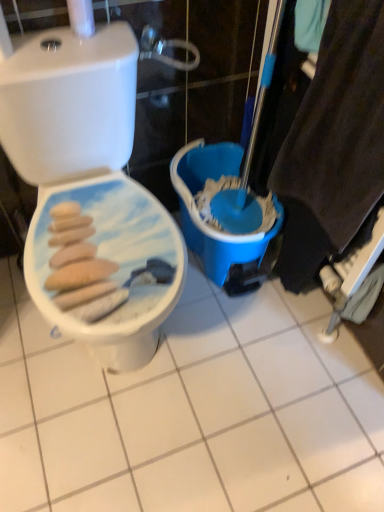
Question: Is blue plastic bucket at center to the right of white glossy ceramic tile at center from the viewer's perspective?

Choices:
 (A) yes
 (B) no

Answer: (A)

Question: From the image's perspective, is blue plastic bucket at center located beneath white glossy ceramic tile at center?

Choices:
 (A) no
 (B) yes

Answer: (A)

Question: Considering the relative sizes of blue plastic bucket at center and white glossy ceramic tile at center in the image provided, is blue plastic bucket at center thinner than white glossy ceramic tile at center?

Choices:
 (A) no
 (B) yes

Answer: (B)

Question: Does blue plastic bucket at center come behind white glossy ceramic tile at center?

Choices:
 (A) yes
 (B) no

Answer: (A)

Question: Can you confirm if blue plastic bucket at center is bigger than white glossy ceramic tile at center?

Choices:
 (A) no
 (B) yes

Answer: (B)

Question: Considering the positions of blue plastic bucket at center and white glossy toilet seat at left in the image, is blue plastic bucket at center taller or shorter than white glossy toilet seat at left?

Choices:
 (A) tall
 (B) short

Answer: (B)

Question: In terms of width, does blue plastic bucket at center look wider or thinner when compared to white glossy toilet seat at left?

Choices:
 (A) wide
 (B) thin

Answer: (B)

Question: Looking at the image, does blue plastic bucket at center seem bigger or smaller compared to white glossy toilet seat at left?

Choices:
 (A) small
 (B) big

Answer: (A)

Question: From the image's perspective, is blue plastic bucket at center located above or below white glossy toilet seat at left?

Choices:
 (A) below
 (B) above

Answer: (B)

Question: From the image's perspective, is white glossy toilet seat at left above or below blue plastic bucket at center?

Choices:
 (A) above
 (B) below

Answer: (B)

Question: Is white glossy toilet seat at left bigger or smaller than blue plastic bucket at center?

Choices:
 (A) big
 (B) small

Answer: (A)

Question: In terms of height, does white glossy toilet seat at left look taller or shorter compared to blue plastic bucket at center?

Choices:
 (A) tall
 (B) short

Answer: (A)

Question: Is white glossy toilet seat at left wider or thinner than blue plastic bucket at center?

Choices:
 (A) thin
 (B) wide

Answer: (B)

Question: From a real-world perspective, is white glossy ceramic tile at center above or below blue plastic bucket at center?

Choices:
 (A) above
 (B) below

Answer: (B)

Question: Looking at their shapes, would you say white glossy ceramic tile at center is wider or thinner than blue plastic bucket at center?

Choices:
 (A) wide
 (B) thin

Answer: (A)